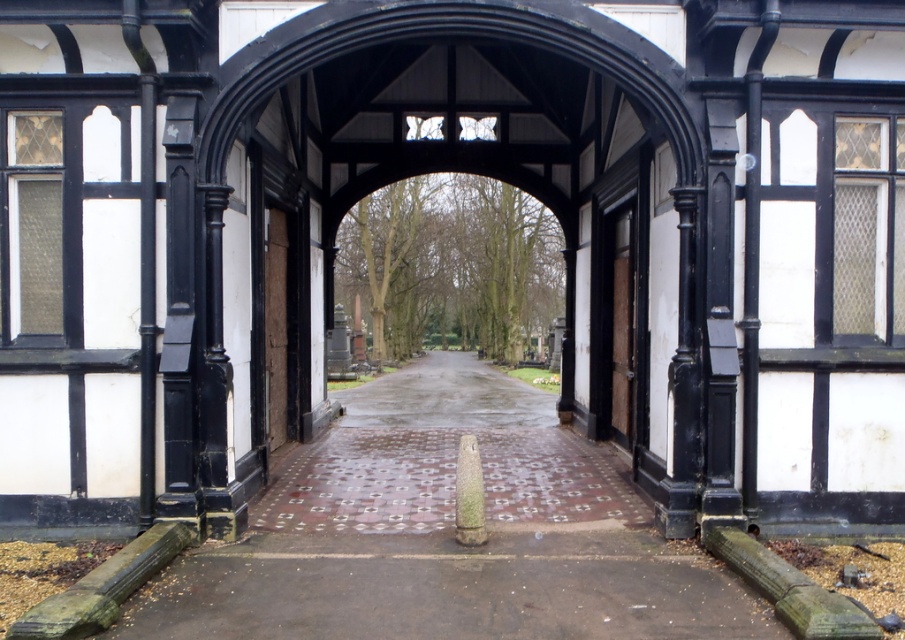
Can you confirm if black timber archway at center is shorter than brick paved path at center?

No.

Is point (349, 42) in front of point (446, 577)?

No, (349, 42) is behind (446, 577).

Locate an element on the screen. black timber archway at center is located at coordinates (453, 172).

Can you confirm if brick paved path at center is thinner than wooden door at center?

Incorrect, brick paved path at center's width is not less than wooden door at center's.

Where is `brick paved path at center`? This screenshot has width=905, height=640. brick paved path at center is located at coordinates 446,534.

Based on the photo, can you confirm if black timber archway at center is bigger than wooden door at center?

Yes, black timber archway at center is bigger than wooden door at center.

Based on the photo, measure the distance between black timber archway at center and camera.

They are 6.86 meters apart.

Where is `black timber archway at center`? This screenshot has width=905, height=640. black timber archway at center is located at coordinates (453, 172).